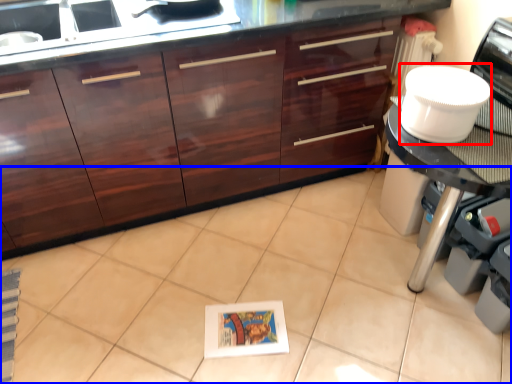
Question: Which of the following is the farthest to the observer, appliance (highlighted by a red box) or ceramic tile (highlighted by a blue box)?

Choices:
 (A) appliance
 (B) ceramic tile

Answer: (A)